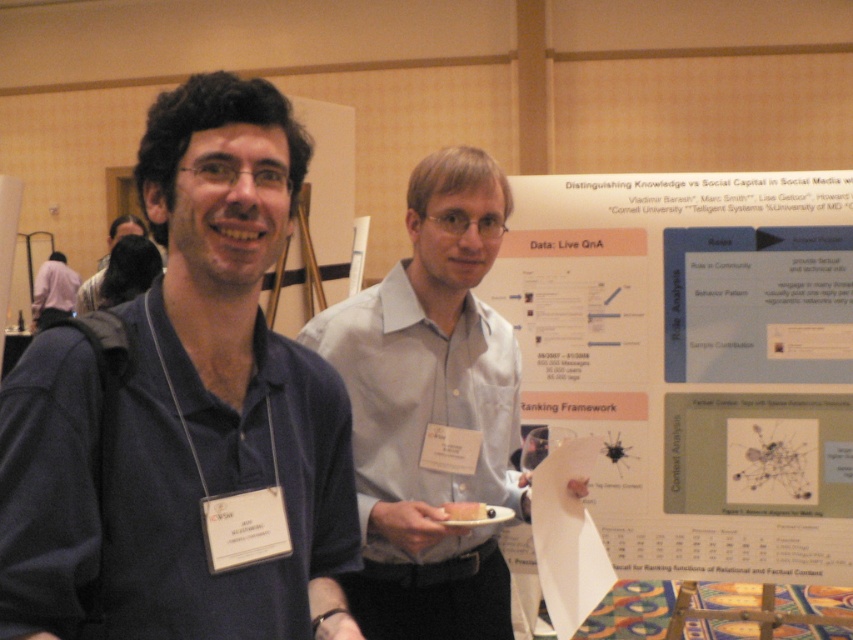
You are organizing a photo shoot and need to arrange two models wearing the matte blue shirt at center and the white shirt at center. The photo requires the thinner model to stand in front. Which shirt should be placed in front?

The matte blue shirt at center is thinner than the white shirt at center, so the model wearing the matte blue shirt at center should be placed in front.